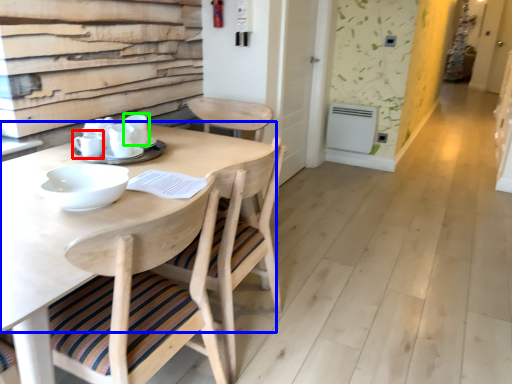
Question: Considering the real-world distances, which object is closest to tableware (highlighted by a red box)? round table (highlighted by a blue box) or tableware (highlighted by a green box).

Choices:
 (A) round table
 (B) tableware

Answer: (B)